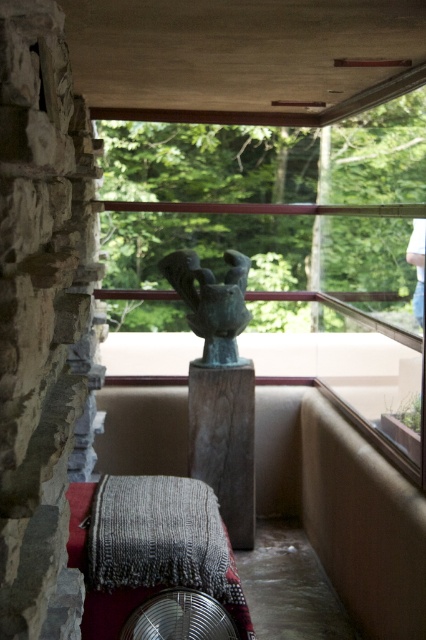
Consider the image. You are a painter who needs to decide which object to paint first between the green patina metal sculpture at center and the wooden pole at center. If you want to paint the wider object first, which one should you choose?

The green patina metal sculpture at center is wider than the wooden pole at center, so you should paint the green patina metal sculpture at center first.

From the picture: You are designing a new sculpture display for an art gallery. The wooden pole at center and bronze statue at center are both part of the exhibit. If you want to ensure stability, which object should you place at the base of the display?

The bronze statue at center should be placed at the base because it is thicker than the wooden pole at center, providing a more stable foundation.